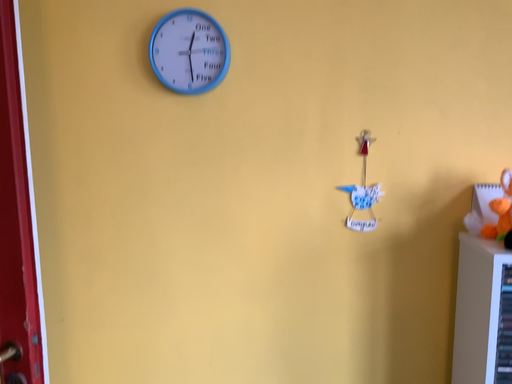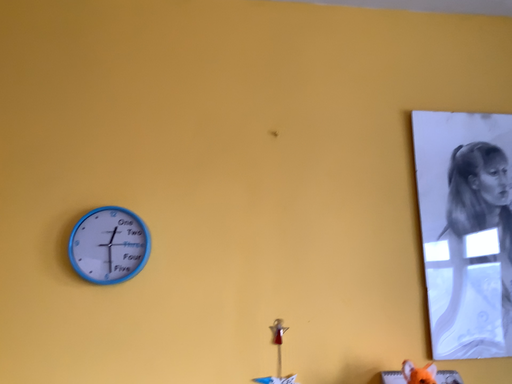
Question: Which way did the camera rotate in the video?

Choices:
 (A) rotated downward
 (B) rotated upward

Answer: (B)